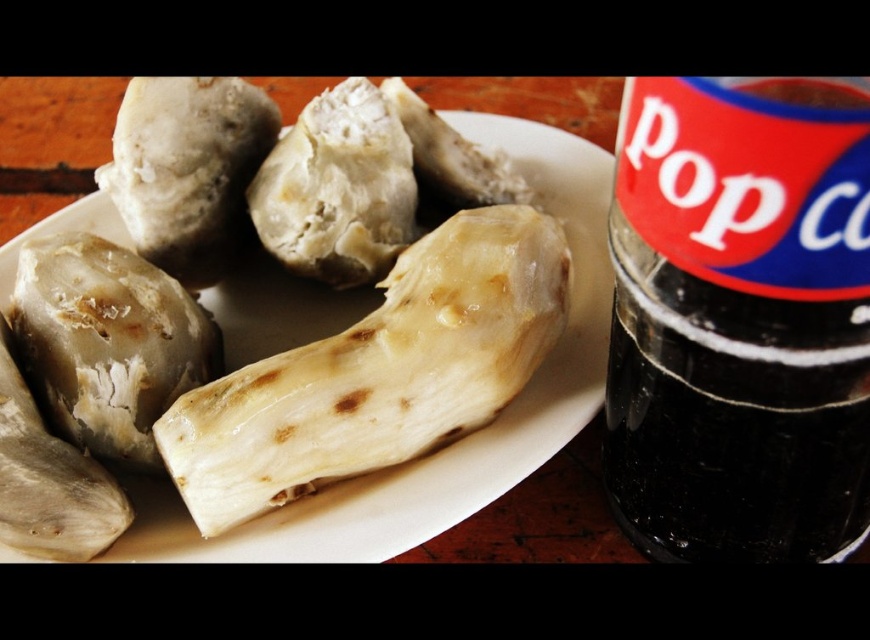
Based on the scene description, where is the white matte plate at center located in terms of coordinates?

The white matte plate at center is located at coordinates (454,442).